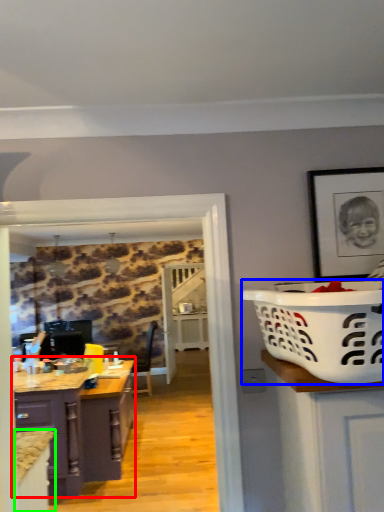
Question: Based on their relative distances, which object is nearer to cabinetry (highlighted by a red box)? Choose from basket container (highlighted by a blue box) and cabinetry (highlighted by a green box).

Choices:
 (A) basket container
 (B) cabinetry

Answer: (B)